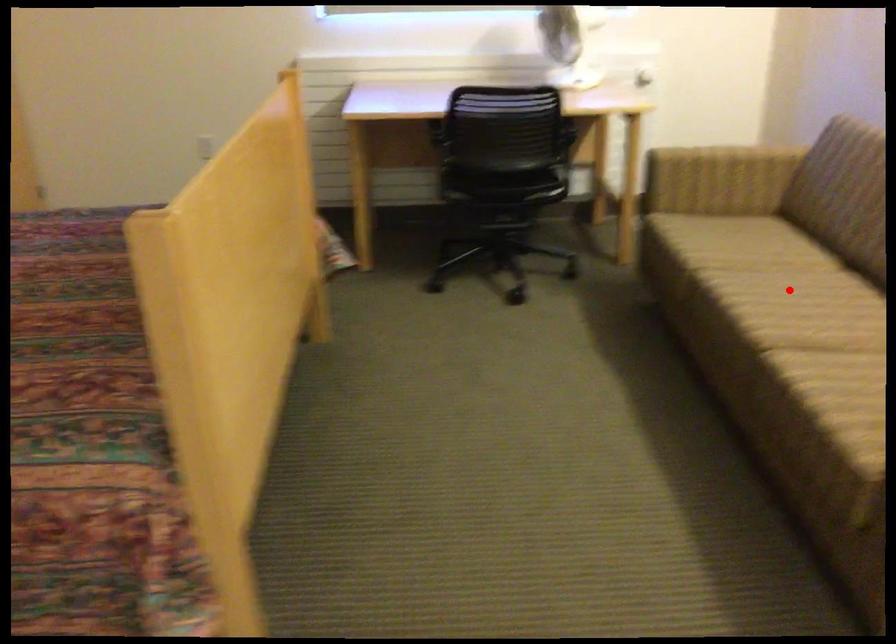
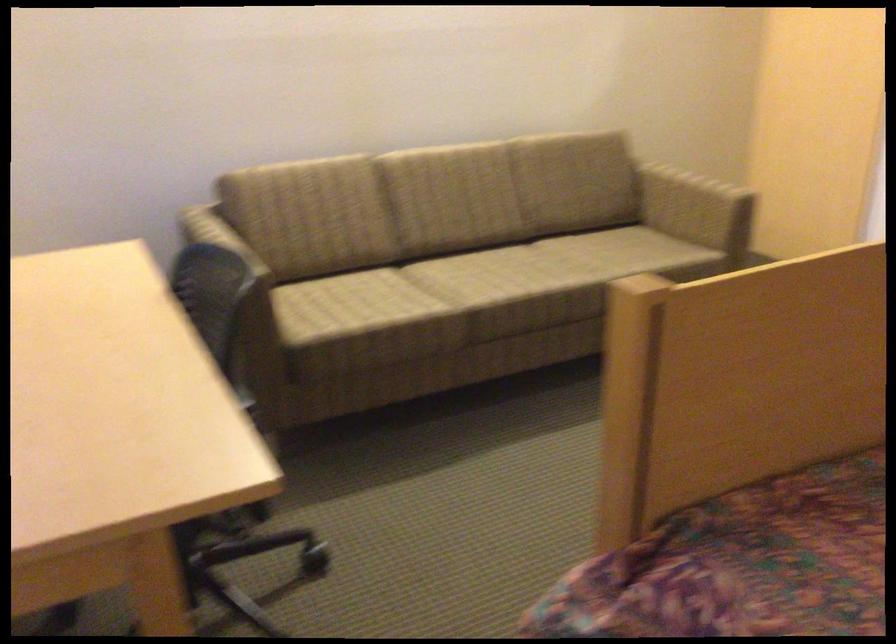
Question: I am providing you with two images of the same scene from different viewpoints. A red point is marked on the first image. Can you still see the location of the red point in image 2?

Choices:
 (A) Yes
 (B) No

Answer: (A)